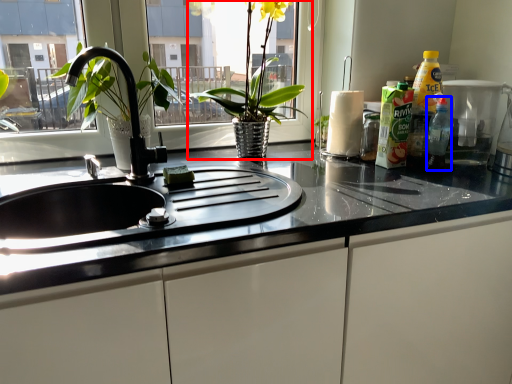
Question: Which object appears farthest to the camera in this image, houseplant (highlighted by a red box) or bottle (highlighted by a blue box)?

Choices:
 (A) houseplant
 (B) bottle

Answer: (B)